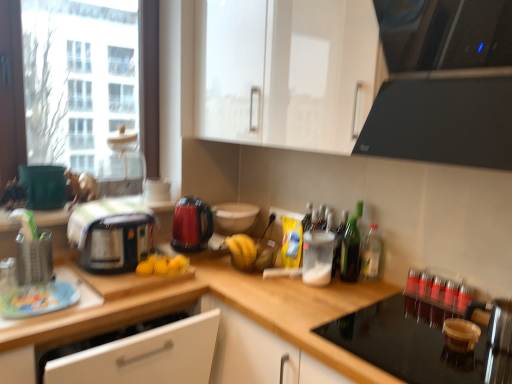
What are the coordinates of `vacant space to the right of green glass bottle at right, which is the 1th bottle in left-to-right order` in the screenshot? It's located at (381, 286).